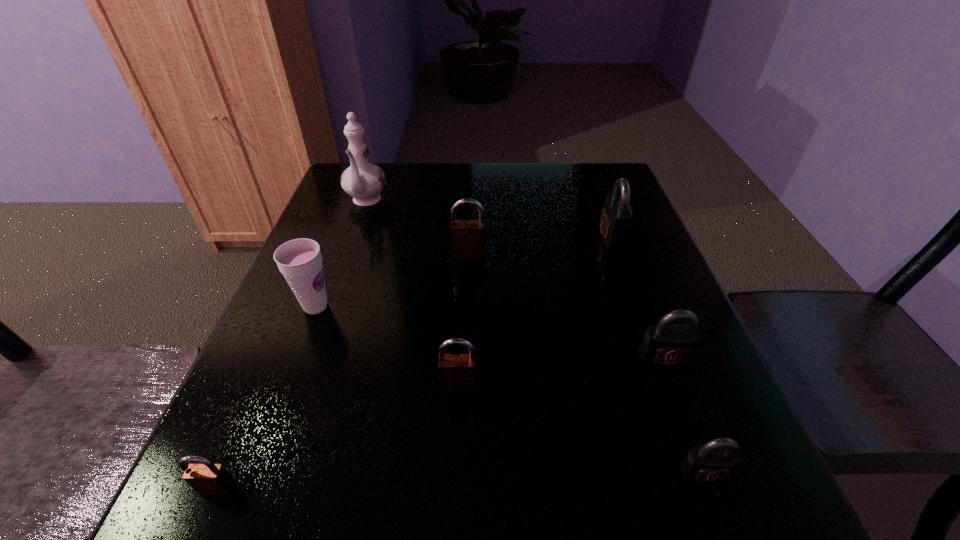
Identify which gray padlock is the second closest to the nearest brown padlock. Please provide its 2D coordinates. Your answer should be formatted as a tuple, i.e. [(x, y)], where the tuple contains the x and y coordinates of a point satisfying the conditions above.

[(664, 345)]

This screenshot has width=960, height=540. What are the coordinates of `gray padlock object that ranks as the second closest to the third farthest padlock` in the screenshot? It's located at 616,216.

Find the location of a particular element. This screenshot has height=540, width=960. brown padlock that stands as the closest to the leftmost brown padlock is located at coordinates (457, 372).

At what (x,y) coordinates should I click in order to perform the action: click on the closest brown padlock relative to the third farthest object. Please return your answer as a coordinate pair (x, y). Looking at the image, I should click on (457, 372).

Identify the location of free space that satisfies the following two spatial constraints: 1. on the front of the farthest padlock near the keyhole; 2. on the front-facing side of the third farthest object. (618, 255).